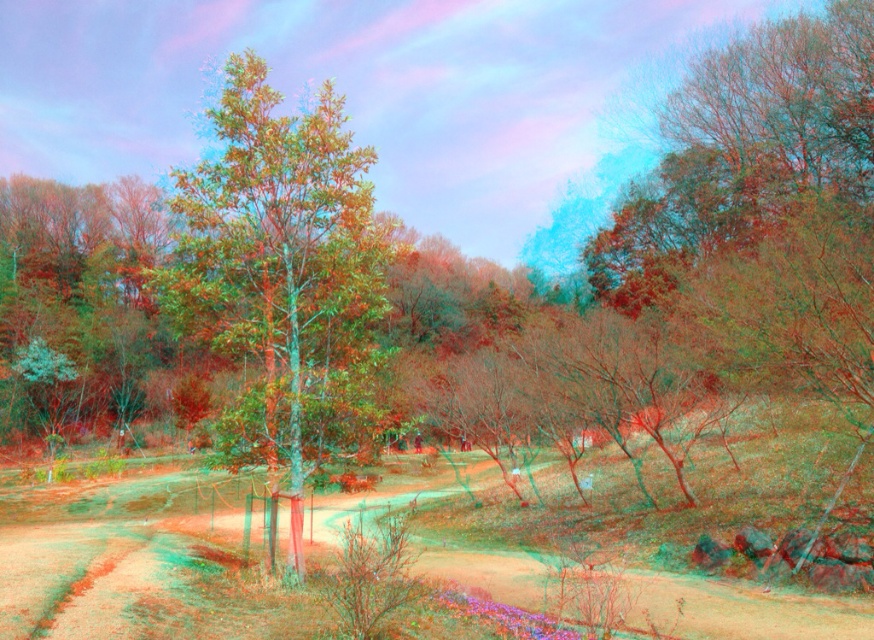
You are a hiker who wants to walk along the brown dirt track at center. Is the green matte tree at center blocking your path?

The brown dirt track at center is positioned under green matte tree at center, which means the tree is above the path. Since the tree is above the path, it is not blocking your way, so you can walk along the brown dirt track at center without any obstruction from the green matte tree at center.